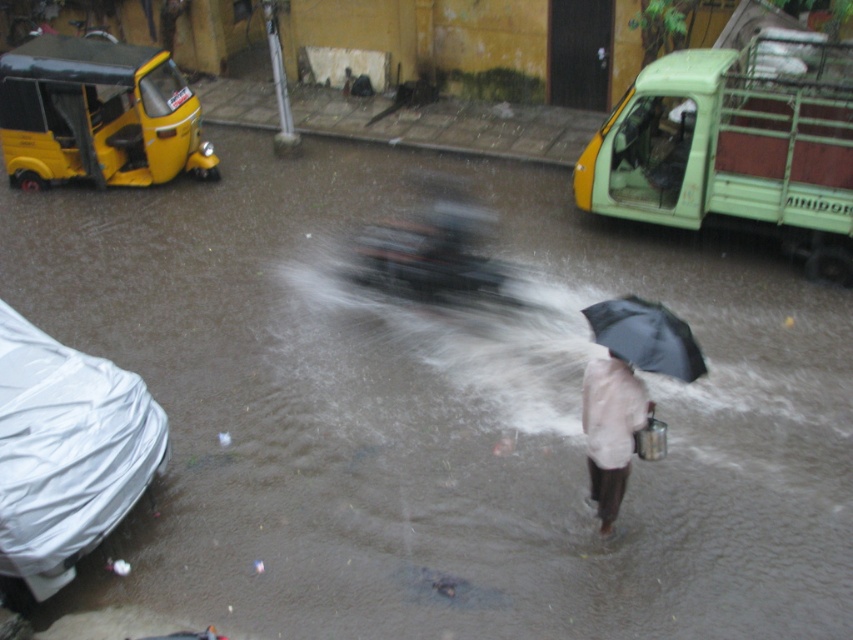
You are a delivery person trying to navigate through the flooded street. You see a white plastic car at lower left and a black matte umbrella at center. Which object is wider?

The white plastic car at lower left is wider than the black matte umbrella at center.

You are a delivery person needing to reach the flooded area in the image. Your drone can fly up to 5 meters. Can your drone reach the white plastic car at lower left?

The distance between the white plastic car at lower left and the camera is 5.60 meters. Since the drone can only fly up to 5 meters, it cannot reach the white plastic car at lower left.

In the flooded urban street scene, where is the white plastic car at lower left located in terms of coordinates?

The white plastic car at lower left is located at point coordinates of (67, 454).